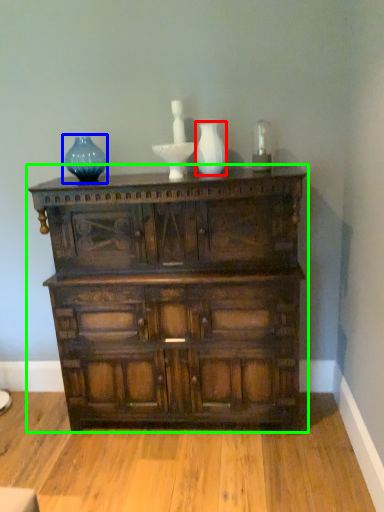
Question: Which object is the closest to the glass vase (highlighted by a red box)? Choose among these: vase (highlighted by a blue box) or chest of drawers (highlighted by a green box).

Choices:
 (A) vase
 (B) chest of drawers

Answer: (A)